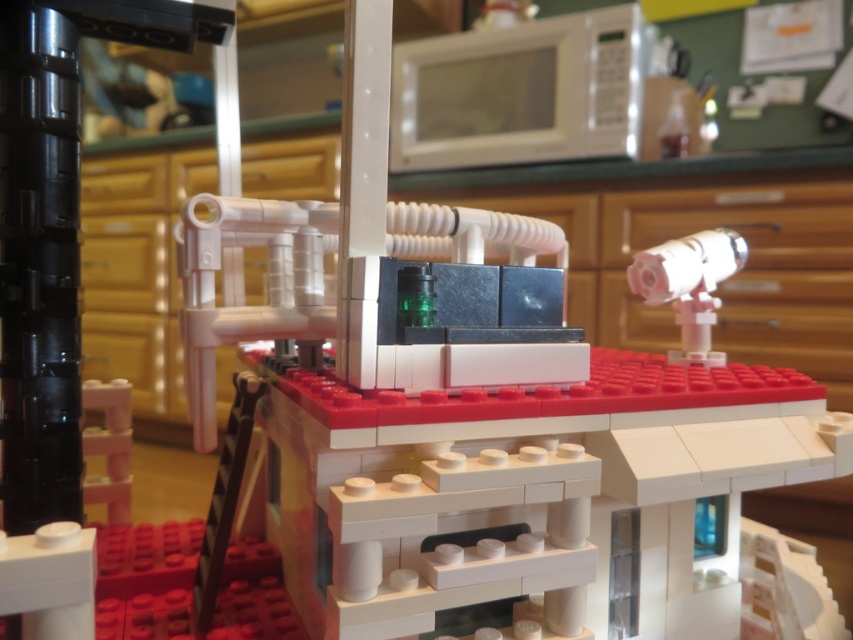
Question: Which point appears farthest from the camera in this image?

Choices:
 (A) (496, 145)
 (B) (676, 323)

Answer: (A)

Question: Can you confirm if white glossy microwave at upper center is positioned to the left of matte white telescope at upper right?

Choices:
 (A) no
 (B) yes

Answer: (B)

Question: Which point appears closest to the camera in this image?

Choices:
 (A) (614, 120)
 (B) (744, 250)

Answer: (B)

Question: Is white glossy microwave at upper center thinner than matte white telescope at upper right?

Choices:
 (A) no
 (B) yes

Answer: (A)

Question: Does white glossy microwave at upper center have a smaller size compared to matte white telescope at upper right?

Choices:
 (A) yes
 (B) no

Answer: (B)